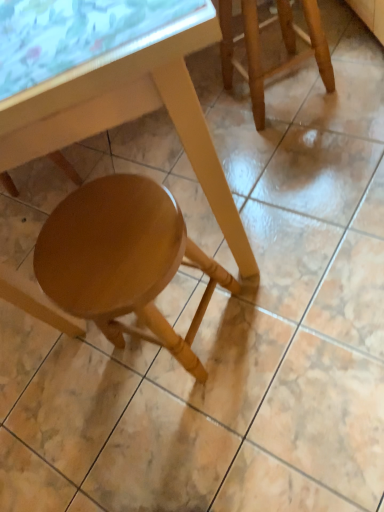
In order to face transparent glass table at upper left, should I rotate leftwards or rightwards?

Rotate left and turn 16.472 degrees.

What do you see at coordinates (260, 49) in the screenshot? I see `wooden stool at upper right, the 1th stool viewed from the right` at bounding box center [260, 49].

Locate an element on the screen. This screenshot has width=384, height=512. wooden stool at upper right, the 1th stool positioned from the top is located at coordinates (260, 49).

The height and width of the screenshot is (512, 384). Describe the element at coordinates (123, 260) in the screenshot. I see `glossy wood stool at lower center, which is the second stool in top-to-bottom order` at that location.

The image size is (384, 512). I want to click on transparent glass table at upper left, so click(x=82, y=38).

Can you confirm if glossy wood stool at lower center, which is the 1th stool in left-to-right order, is taller than wooden stool at upper right, the 1th stool viewed from the right?

Indeed, glossy wood stool at lower center, which is the 1th stool in left-to-right order, has a greater height compared to wooden stool at upper right, the 1th stool viewed from the right.

Between glossy wood stool at lower center, which is counted as the 2th stool, starting from the right, and wooden stool at upper right, arranged as the 2th stool when viewed from the left, which one appears on the left side from the viewer's perspective?

From the viewer's perspective, glossy wood stool at lower center, which is counted as the 2th stool, starting from the right, appears more on the left side.

Is glossy wood stool at lower center, marked as the first stool in a bottom-to-top arrangement, facing towards wooden stool at upper right, which is the second stool in bottom-to-top order?

No.

Based on the photo, can we say glossy wood stool at lower center, which is the second stool in top-to-bottom order, lies outside wooden stool at upper right, the 1th stool positioned from the top?

Yes, glossy wood stool at lower center, which is the second stool in top-to-bottom order, is located beyond the bounds of wooden stool at upper right, the 1th stool positioned from the top.

From the image's perspective, who appears lower, transparent glass table at upper left or glossy wood stool at lower center, which is the 1th stool in left-to-right order?

glossy wood stool at lower center, which is the 1th stool in left-to-right order.

Does point (148, 44) come farther from viewer compared to point (52, 230)?

No, (148, 44) is in front of (52, 230).

Can you confirm if transparent glass table at upper left is bigger than glossy wood stool at lower center, which is the 1th stool in left-to-right order?

No, transparent glass table at upper left is not bigger than glossy wood stool at lower center, which is the 1th stool in left-to-right order.

Would you consider transparent glass table at upper left to be distant from glossy wood stool at lower center, which is the 1th stool in left-to-right order?

They are positioned close to each other.

Is matte wood table at lower center a part of transparent glass table at upper left?

No, matte wood table at lower center is not a part of transparent glass table at upper left.

Does transparent glass table at upper left have a greater height compared to matte wood table at lower center?

No, transparent glass table at upper left is not taller than matte wood table at lower center.

Is point (90, 19) farther from camera compared to point (197, 119)?

No.

Locate an element on the screen. The image size is (384, 512). table in front of the transparent glass table at upper left is located at coordinates (131, 116).

Where is `table in front of the glossy wood stool at lower center, which is the second stool in top-to-bottom order`? The width and height of the screenshot is (384, 512). table in front of the glossy wood stool at lower center, which is the second stool in top-to-bottom order is located at coordinates 131,116.

Based on the photo, considering the relative sizes of glossy wood stool at lower center, which is the second stool in top-to-bottom order, and matte wood table at lower center in the image provided, is glossy wood stool at lower center, which is the second stool in top-to-bottom order, thinner than matte wood table at lower center?

Yes, glossy wood stool at lower center, which is the second stool in top-to-bottom order, is thinner than matte wood table at lower center.

Is glossy wood stool at lower center, which is the 1th stool in left-to-right order, at the left side of matte wood table at lower center?

In fact, glossy wood stool at lower center, which is the 1th stool in left-to-right order, is to the right of matte wood table at lower center.

Relative to matte wood table at lower center, is glossy wood stool at lower center, which is counted as the 2th stool, starting from the right, in front or behind?

Clearly, glossy wood stool at lower center, which is counted as the 2th stool, starting from the right, is behind matte wood table at lower center.

Is transparent glass table at upper left next to wooden stool at upper right, arranged as the 2th stool when viewed from the left, and touching it?

There is a gap between transparent glass table at upper left and wooden stool at upper right, arranged as the 2th stool when viewed from the left.

Can you confirm if transparent glass table at upper left is positioned to the right of wooden stool at upper right, the 1th stool viewed from the right?

No.

Image resolution: width=384 pixels, height=512 pixels. I want to click on glass table above the wooden stool at upper right, the 1th stool positioned from the top (from a real-world perspective), so click(x=82, y=38).

How distant is transparent glass table at upper left from wooden stool at upper right, the 1th stool positioned from the top?

34.45 inches.

Looking at their sizes, would you say wooden stool at upper right, the 1th stool positioned from the top, is wider or thinner than transparent glass table at upper left?

Clearly, wooden stool at upper right, the 1th stool positioned from the top, has less width compared to transparent glass table at upper left.

Which of these two, wooden stool at upper right, the 1th stool positioned from the top, or transparent glass table at upper left, stands taller?

wooden stool at upper right, the 1th stool positioned from the top, is taller.

Consider the image. Looking at the image, does wooden stool at upper right, the 1th stool viewed from the right, seem bigger or smaller compared to transparent glass table at upper left?

In the image, wooden stool at upper right, the 1th stool viewed from the right, appears to be larger than transparent glass table at upper left.

You are a GUI agent. You are given a task and a screenshot of the screen. Output one action in this format:
    pyautogui.click(x=<x>, y=<y>)
    Task: Click on the stool above the transparent glass table at upper left (from the image's perspective)
    The height and width of the screenshot is (512, 384).
    Given the screenshot: What is the action you would take?
    [x=260, y=49]

Which of these two, matte wood table at lower center or transparent glass table at upper left, is bigger?

With larger size is matte wood table at lower center.

From a real-world perspective, which object rests below the other?

In real-world perspective, matte wood table at lower center is lower.

Considering the relative positions of matte wood table at lower center and transparent glass table at upper left in the image provided, is matte wood table at lower center to the left or to the right of transparent glass table at upper left?

matte wood table at lower center is to the left of transparent glass table at upper left.

Where is `stool in front of the wooden stool at upper right, arranged as the 2th stool when viewed from the left`? This screenshot has height=512, width=384. stool in front of the wooden stool at upper right, arranged as the 2th stool when viewed from the left is located at coordinates pyautogui.click(x=123, y=260).

This screenshot has height=512, width=384. What are the coordinates of `the 1st stool behind the transparent glass table at upper left, starting your count from the anchor` in the screenshot? It's located at (123, 260).

Based on their spatial positions, is matte wood table at lower center or glossy wood stool at lower center, marked as the first stool in a bottom-to-top arrangement, further from wooden stool at upper right, which is the second stool in bottom-to-top order?

The object further to wooden stool at upper right, which is the second stool in bottom-to-top order, is glossy wood stool at lower center, marked as the first stool in a bottom-to-top arrangement.

Estimate the real-world distances between objects in this image. Which object is further from glossy wood stool at lower center, which is the second stool in top-to-bottom order, matte wood table at lower center or wooden stool at upper right, the 1th stool positioned from the top?

Among the two, wooden stool at upper right, the 1th stool positioned from the top, is located further to glossy wood stool at lower center, which is the second stool in top-to-bottom order.

When comparing their distances from wooden stool at upper right, the 1th stool positioned from the top, does transparent glass table at upper left or glossy wood stool at lower center, which is counted as the 2th stool, starting from the right, seem closer?

Based on the image, glossy wood stool at lower center, which is counted as the 2th stool, starting from the right, appears to be nearer to wooden stool at upper right, the 1th stool positioned from the top.

Considering their positions, is matte wood table at lower center positioned further to wooden stool at upper right, which is the second stool in bottom-to-top order, than transparent glass table at upper left?

transparent glass table at upper left.

Considering their positions, is transparent glass table at upper left positioned further to matte wood table at lower center than wooden stool at upper right, which is the second stool in bottom-to-top order?

wooden stool at upper right, which is the second stool in bottom-to-top order, lies further to matte wood table at lower center than the other object.

In the scene shown: From the image, which object appears to be farther from transparent glass table at upper left, matte wood table at lower center or glossy wood stool at lower center, which is the 1th stool in left-to-right order?

glossy wood stool at lower center, which is the 1th stool in left-to-right order, lies further to transparent glass table at upper left than the other object.

Based on their spatial positions, is wooden stool at upper right, arranged as the 2th stool when viewed from the left, or matte wood table at lower center closer to glossy wood stool at lower center, which is the 1th stool in left-to-right order?

Among the two, matte wood table at lower center is located nearer to glossy wood stool at lower center, which is the 1th stool in left-to-right order.

Based on their spatial positions, is glossy wood stool at lower center, marked as the first stool in a bottom-to-top arrangement, or wooden stool at upper right, arranged as the 2th stool when viewed from the left, further from transparent glass table at upper left?

Result: wooden stool at upper right, arranged as the 2th stool when viewed from the left.

Identify the location of glass table between matte wood table at lower center and glossy wood stool at lower center, which is counted as the 2th stool, starting from the right, in the up-down direction. 82,38.

I want to click on table between wooden stool at upper right, the 1th stool positioned from the top, and glossy wood stool at lower center, marked as the first stool in a bottom-to-top arrangement, in the vertical direction, so click(131, 116).

Where is `glass table located between matte wood table at lower center and wooden stool at upper right, arranged as the 2th stool when viewed from the left, in the depth direction`? Image resolution: width=384 pixels, height=512 pixels. glass table located between matte wood table at lower center and wooden stool at upper right, arranged as the 2th stool when viewed from the left, in the depth direction is located at coordinates (82, 38).

This screenshot has width=384, height=512. I want to click on glass table between wooden stool at upper right, the 1th stool positioned from the top, and glossy wood stool at lower center, which is the second stool in top-to-bottom order, vertically, so pyautogui.click(x=82, y=38).